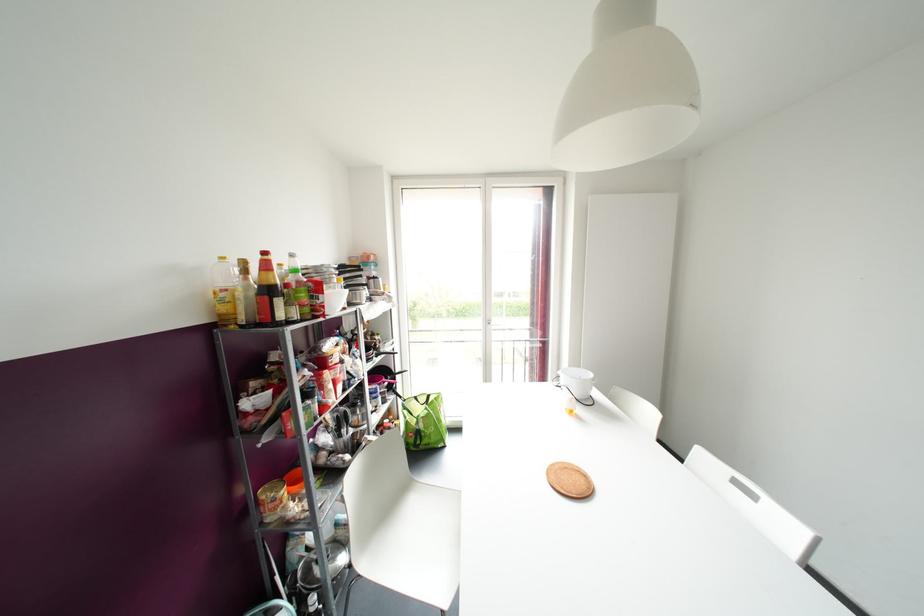
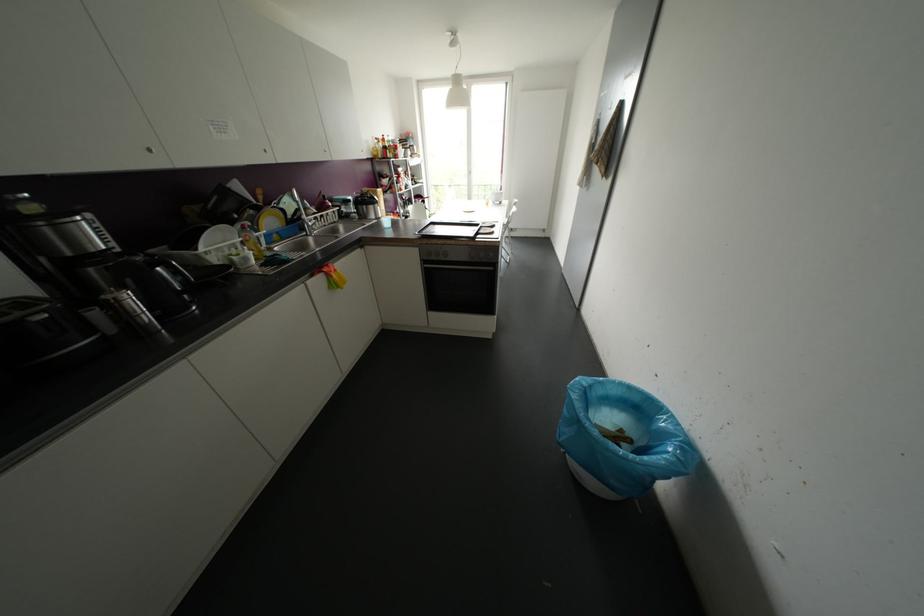
What movement of the cameraman would produce the second image?

The movement direction of the cameraman is right, backward.